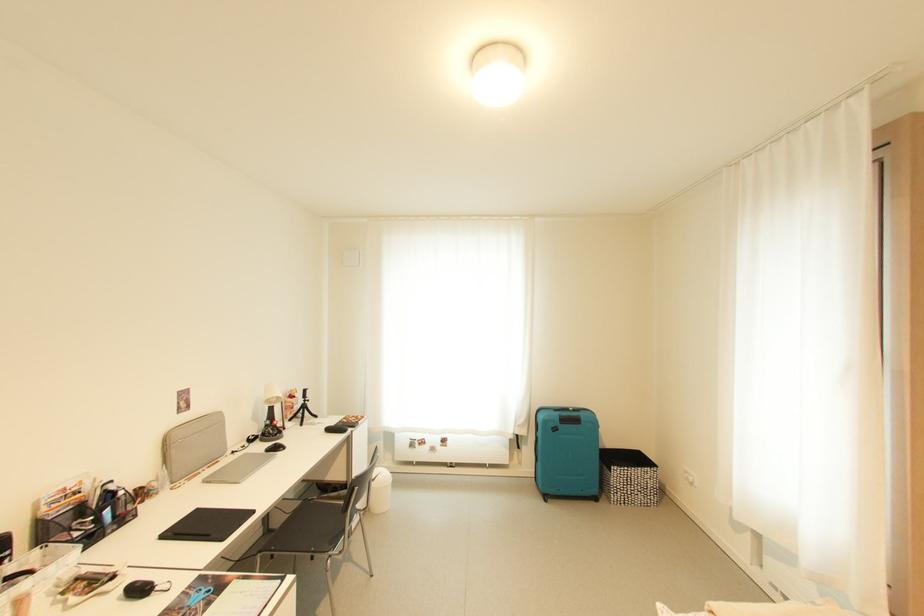
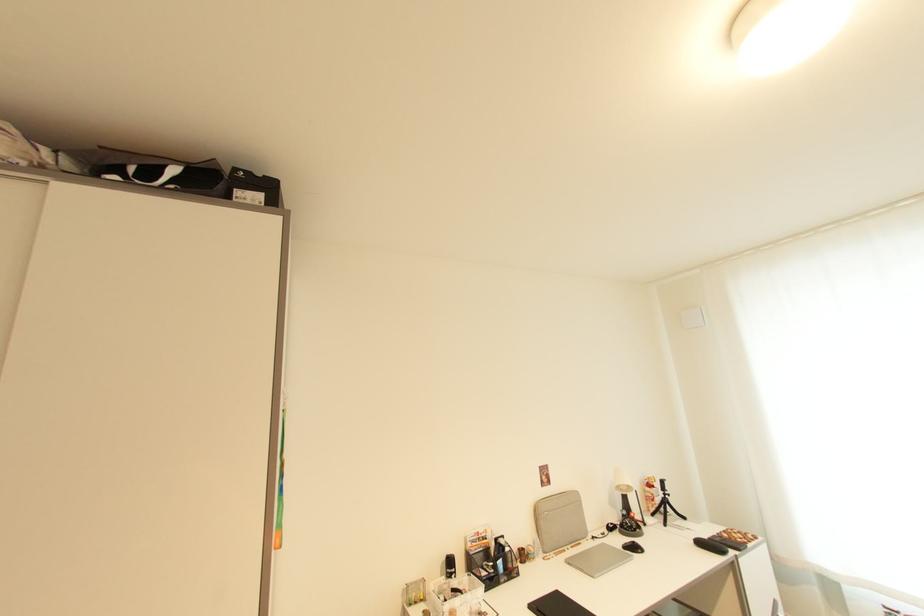
Locate, in the second image, the point that corresponds to the point at 282,450 in the first image.

(639, 549)